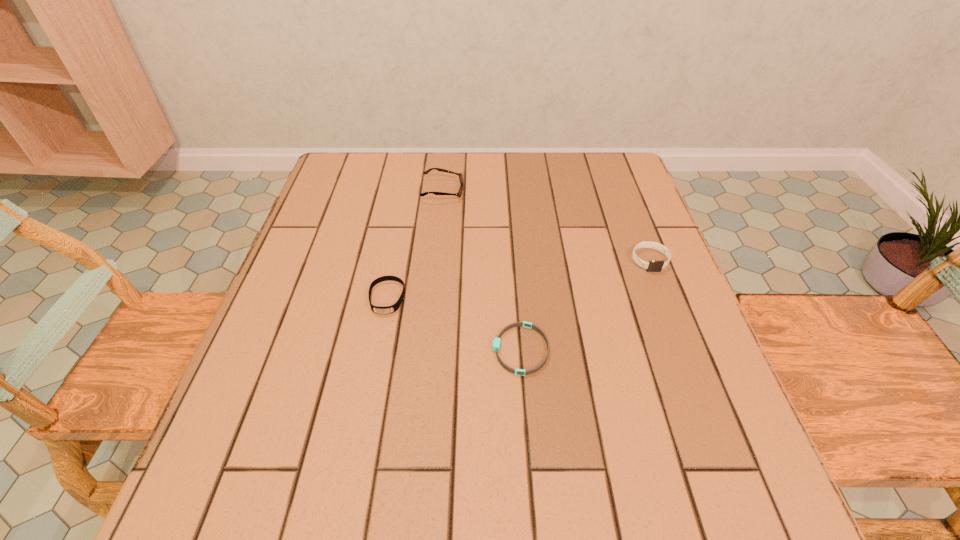
Locate an element on the screen. Image resolution: width=960 pixels, height=540 pixels. the farthest object is located at coordinates (460, 175).

Find the location of a particular element. the third object from right to left is located at coordinates (460, 175).

Locate an element on the screen. This screenshot has height=540, width=960. the tallest wristband is located at coordinates (653, 266).

Find the location of a particular element. the third nearest object is located at coordinates (653, 266).

At what (x,y) coordinates should I click in order to perform the action: click on the second nearest object. Please return your answer as a coordinate pair (x, y). The image size is (960, 540). Looking at the image, I should click on (393, 308).

The image size is (960, 540). What are the coordinates of `the leftmost wristband` in the screenshot? It's located at (393, 308).

I want to click on the nearest object, so click(x=496, y=342).

Where is `the shortest object`? Image resolution: width=960 pixels, height=540 pixels. the shortest object is located at coordinates (496, 342).

Locate an element on the screen. The image size is (960, 540). free region located 0.340m on the lenses of the sunglasses is located at coordinates (590, 191).

Find the location of `vacant space situated 0.240m on the outer surface of the third shortest object`. vacant space situated 0.240m on the outer surface of the third shortest object is located at coordinates 690,366.